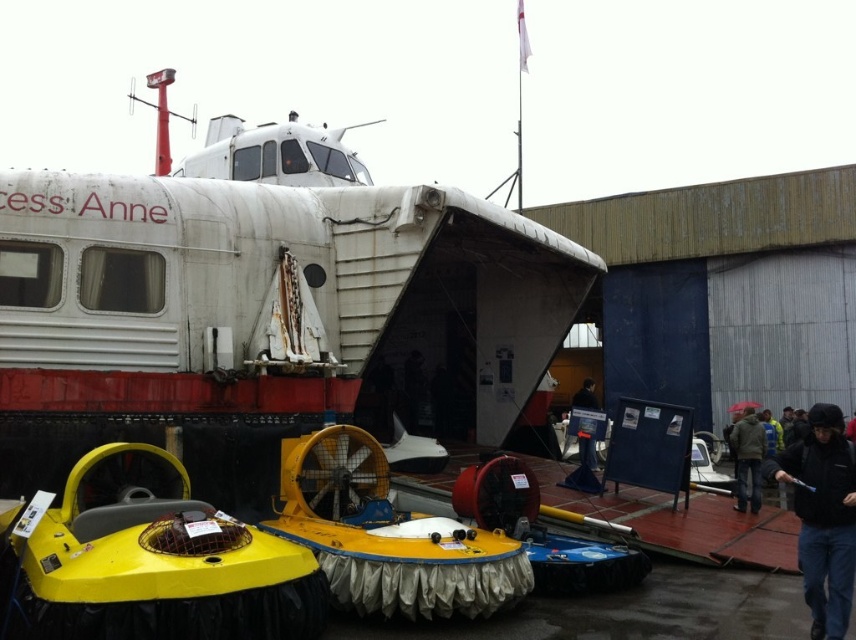
Consider the image. You are standing at the front of the HMS Anne and want to walk to both the point at coordinates point (807,412) and point (584,456). Which point will you reach first?

You will reach point (807,412) first because it is closer to you than point (584,456), which is further away.

You are a photographer standing at the center of the exhibition. You want to take a photo of both the black matte jacket at lower right and the black jacket at lower right in the same frame. Given that your camera has a maximum focal length that allows capturing objects up to 20 meters apart, will you be able to include both jackets in the photo?

The black matte jacket at lower right and black jacket at lower right are 18.06 meters apart. Since the maximum focal length allows capturing objects up to 20 meters apart, yes, both jackets can be included in the photo as the distance between them is within the camera range.

Where is the white matte boat at center located in the image?

The white matte boat at center is located at point (x=266, y=310).